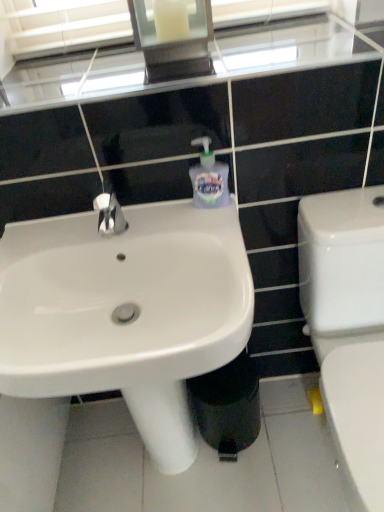
Locate an element on the screen. Image resolution: width=384 pixels, height=512 pixels. free space in front of black plastic trash bin/can at lower center is located at coordinates (244, 490).